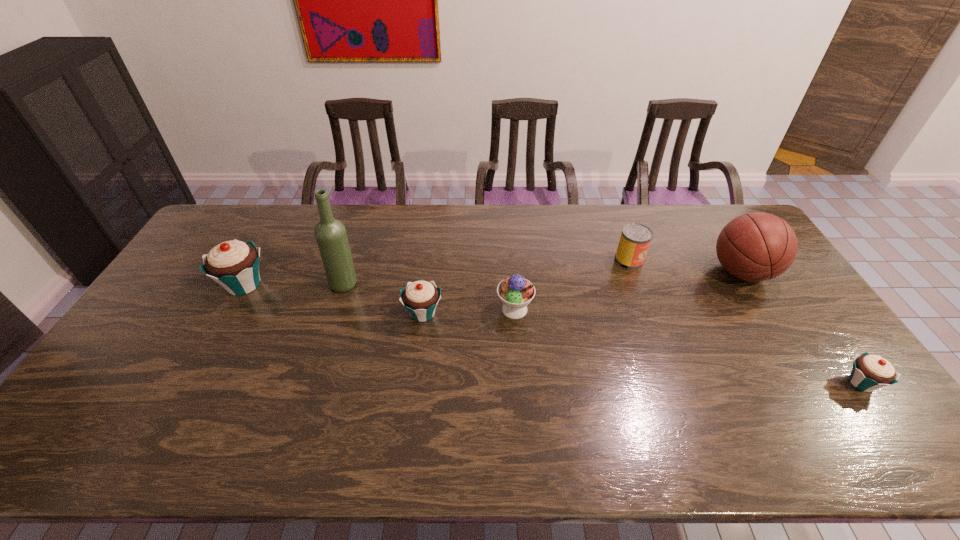
Identify the location of cupcake situated at the right edge. The width and height of the screenshot is (960, 540). (870, 372).

The width and height of the screenshot is (960, 540). Identify the location of basketball present at the right edge. (758, 246).

Image resolution: width=960 pixels, height=540 pixels. In order to click on object present at the near right corner in this screenshot , I will do `click(870, 372)`.

In the image, there is a desktop. Where is `free space at the far edge`? This screenshot has width=960, height=540. free space at the far edge is located at coordinates (527, 241).

Locate an element on the screen. vacant point at the near edge is located at coordinates (600, 411).

The height and width of the screenshot is (540, 960). Identify the location of vacant space at the left edge. tap(147, 356).

Find the location of a particular element. Image resolution: width=960 pixels, height=540 pixels. vacant space at the right edge is located at coordinates (763, 315).

Find the location of `free spot at the far left corner of the desktop`. free spot at the far left corner of the desktop is located at coordinates (212, 243).

The width and height of the screenshot is (960, 540). Find the location of `vacant space that's between the fifth object from left to right and the nearest object`. vacant space that's between the fifth object from left to right and the nearest object is located at coordinates (745, 321).

This screenshot has width=960, height=540. I want to click on vacant space that is in between the fifth object from left to right and the nearest cupcake, so click(745, 321).